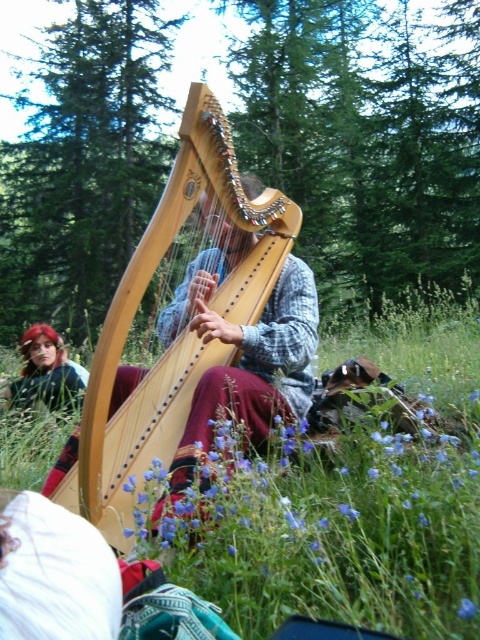
Consider the image. Does green grass at center appear under natural wood harp at center?

Correct, green grass at center is located below natural wood harp at center.

This screenshot has height=640, width=480. What do you see at coordinates (360, 512) in the screenshot? I see `green grass at center` at bounding box center [360, 512].

I want to click on green grass at center, so click(x=360, y=512).

Who is positioned more to the left, natural wood harp at center or shiny red hair at lower left?

Positioned to the left is shiny red hair at lower left.

Who is shorter, natural wood harp at center or shiny red hair at lower left?

shiny red hair at lower left

You are a GUI agent. You are given a task and a screenshot of the screen. Output one action in this format:
    pyautogui.click(x=<x>, y=<y>)
    Task: Click on the natural wood harp at center
    
    Given the screenshot: What is the action you would take?
    pyautogui.click(x=166, y=349)

Can you confirm if green grass at center is positioned to the right of shiny red hair at lower left?

Correct, you'll find green grass at center to the right of shiny red hair at lower left.

Which is behind, point (373, 540) or point (43, 333)?

The point (43, 333) is more distant.

The image size is (480, 640). Find the location of `green grass at center`. green grass at center is located at coordinates (360, 512).